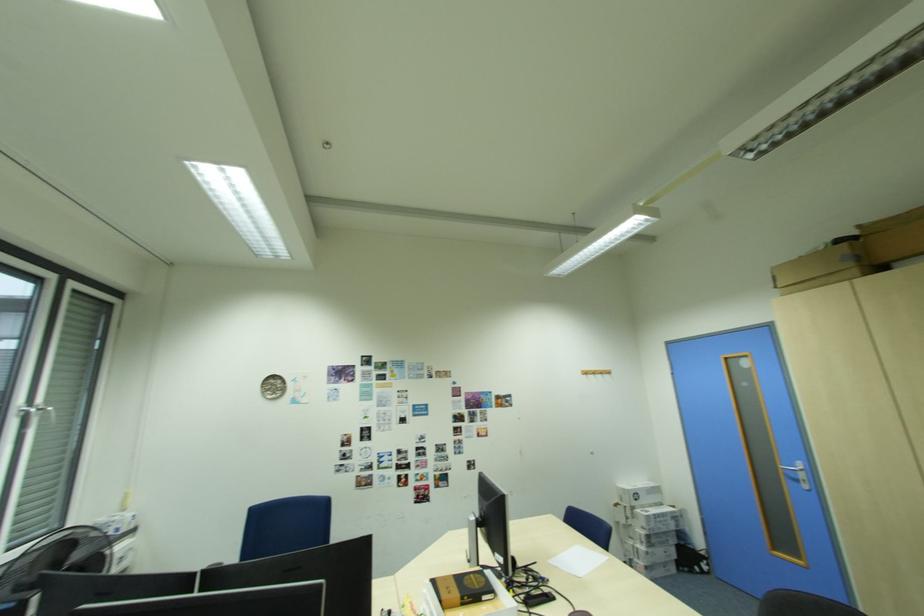
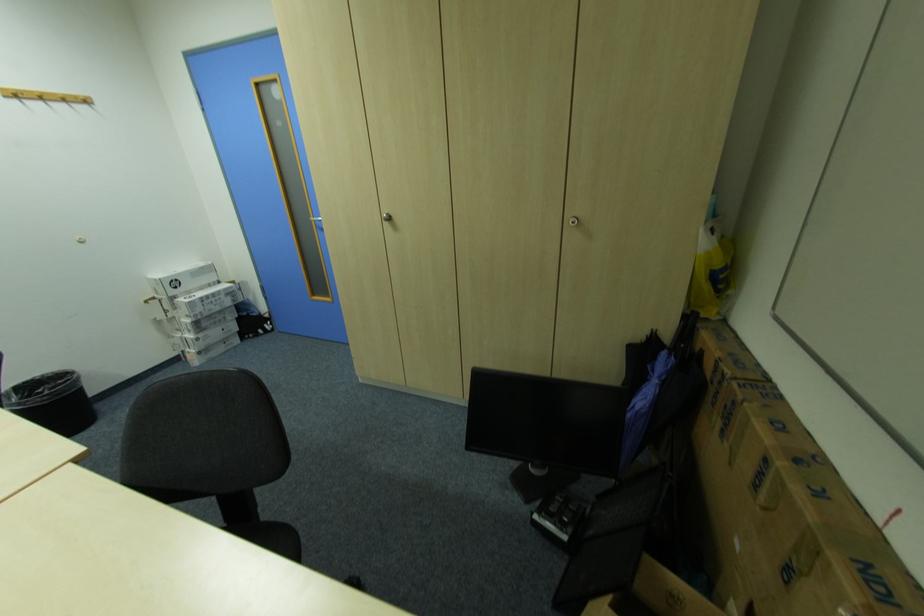
Locate, in the second image, the point that corresponds to [787,469] in the first image.

(322, 225)